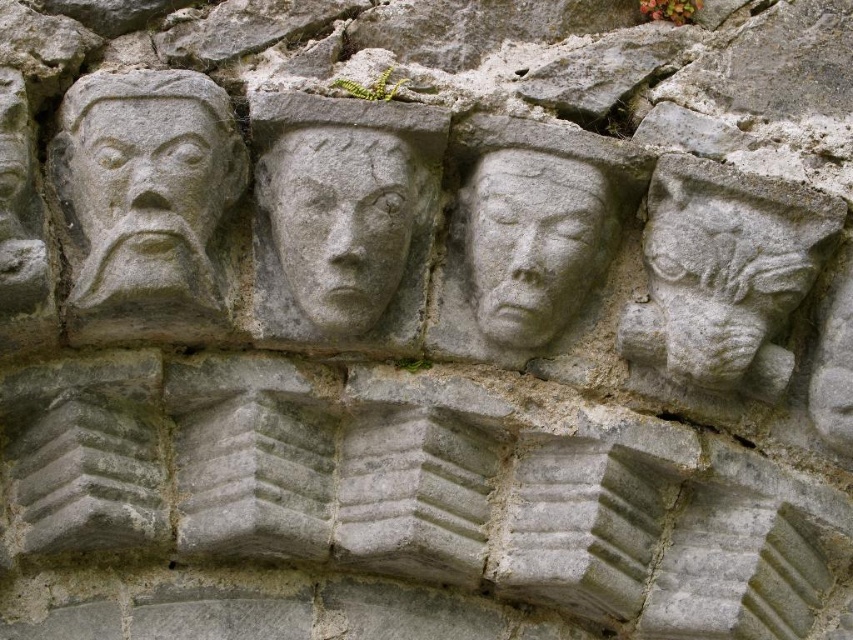
You are an art conservator measuring the spacing between two carvings on a stone wall. You need to determine if there is enough space to safely insert a protective barrier between them. The barrier requires a minimum of 10 centimeters of space. Are the stone carved face at right and the gray stone carving at center spaced adequately?

The stone carved face at right and the gray stone carving at center are 10.25 centimeters apart, which meets the required minimum of 10 centimeters. Therefore, the protective barrier can be safely inserted between them.

You are an art student analyzing the stone wall carvings. You notice two faces, the stone carved face at right and the gray stone face at center. Which of these two faces is positioned lower on the wall?

The stone carved face at right is positioned lower on the wall than the gray stone face at center.

You are an architect examining the stone wall. You notice the stone carved face at right and the gray stone carving at center. Which one has a greater height?

The stone carved face at right is much taller than the gray stone carving at center, so it has a greater height.